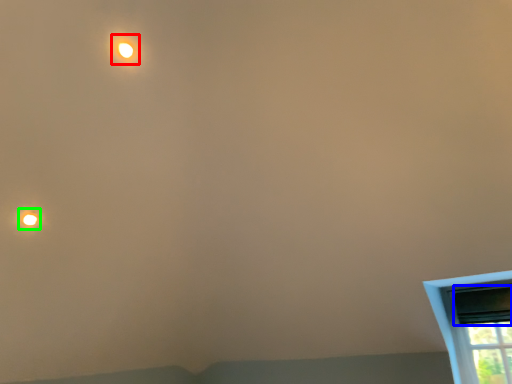
Question: Which object is the closest to the light (highlighted by a red box)? Choose among these: window screen (highlighted by a blue box) or droplight (highlighted by a green box).

Choices:
 (A) window screen
 (B) droplight

Answer: (B)